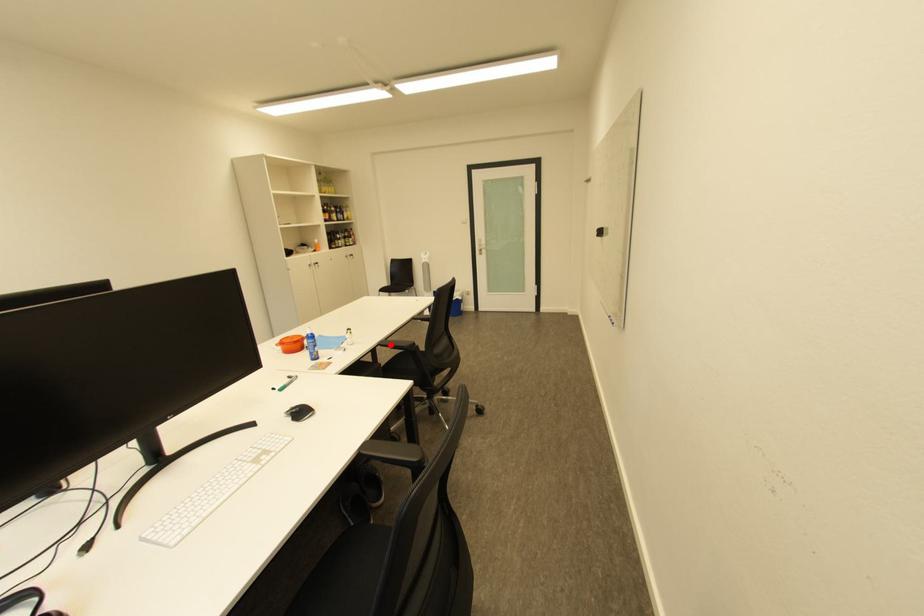
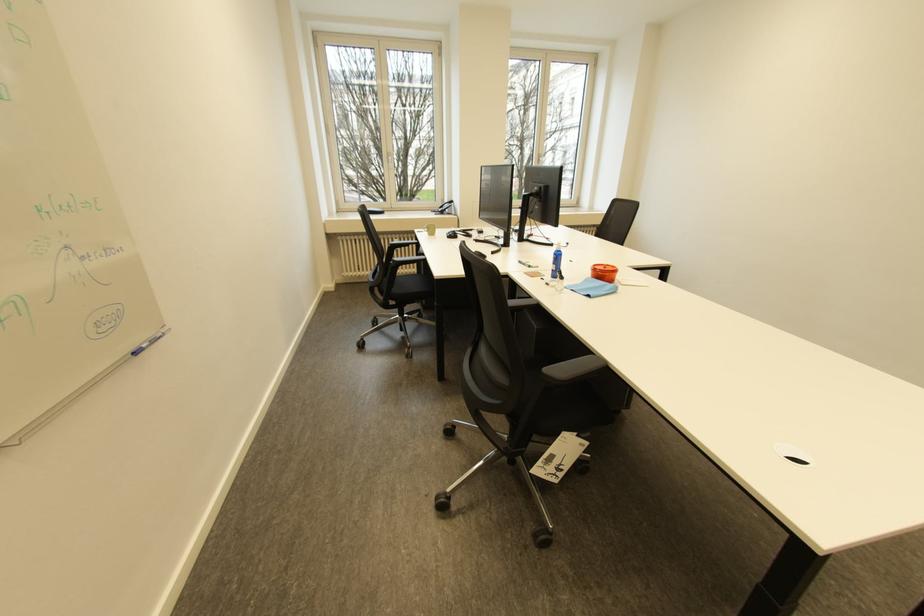
Question: I am providing you with two images of the same scene from different viewpoints. A red point is marked on the first image. Can you still see the location of the red point in image 2?

Choices:
 (A) Yes
 (B) No

Answer: (B)